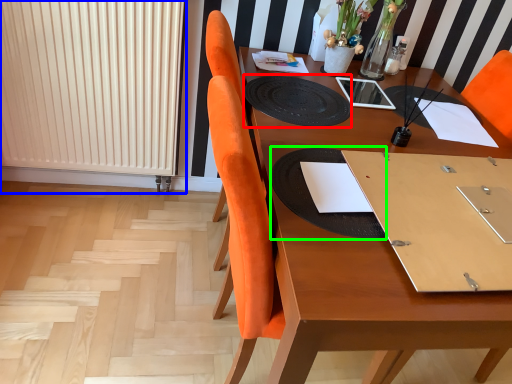
Question: Based on their relative distances, which object is farther from mat (highlighted by a red box)? Choose from radiator (highlighted by a blue box) and place mat (highlighted by a green box).

Choices:
 (A) radiator
 (B) place mat

Answer: (A)